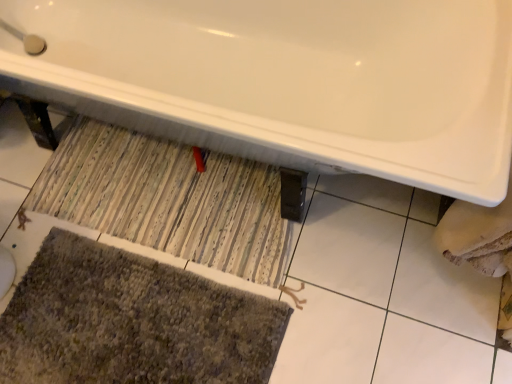
Find the location of `vacant space underneath textured gray bath mat at lower left (from a real-world perspective)`. vacant space underneath textured gray bath mat at lower left (from a real-world perspective) is located at coordinates (121, 327).